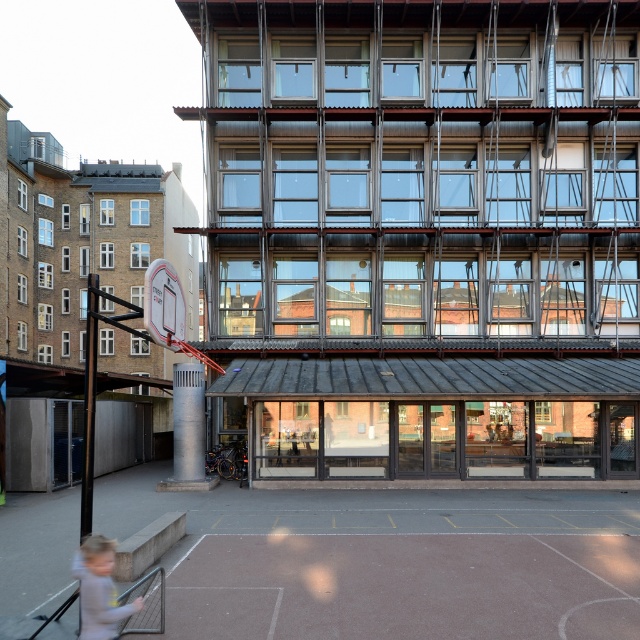
This screenshot has width=640, height=640. Describe the element at coordinates (168, 310) in the screenshot. I see `white plastic basketball hoop at left` at that location.

What do you see at coordinates (168, 310) in the screenshot?
I see `white plastic basketball hoop at left` at bounding box center [168, 310].

Image resolution: width=640 pixels, height=640 pixels. I want to click on white plastic basketball hoop at left, so click(x=168, y=310).

Is point (97, 541) positioned in front of point (148, 285)?

Yes, it is in front of point (148, 285).

Who is more distant from viewer, (115, 636) or (192, 349)?

The point (192, 349) is behind.

Describe the element at coordinates (99, 589) in the screenshot. I see `light gray fabric at lower left` at that location.

Find the location of `light gray fabric at lower left`. light gray fabric at lower left is located at coordinates (99, 589).

Measure the distance between point (x=102, y=637) and camera.

The distance of point (x=102, y=637) from camera is 6.59 meters.

Does point (106, 589) come farther from viewer compared to point (176, 280)?

That is False.

Who is more distant from viewer, (x=106, y=547) or (x=163, y=317)?

Point (x=163, y=317)

Locate an element on the screen. This screenshot has width=640, height=640. light gray fabric at lower left is located at coordinates (99, 589).